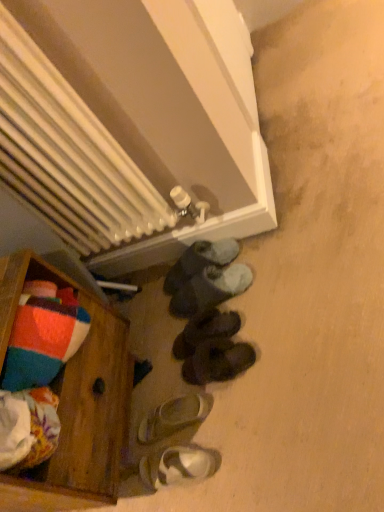
The height and width of the screenshot is (512, 384). Identify the location of vacant space that's between white matte sandals at lower center, arranged as the 1th footwear when ordered from the bottom, and white matte sandal at lower center, which ranks as the 2th footwear in bottom-to-top order. (174, 437).